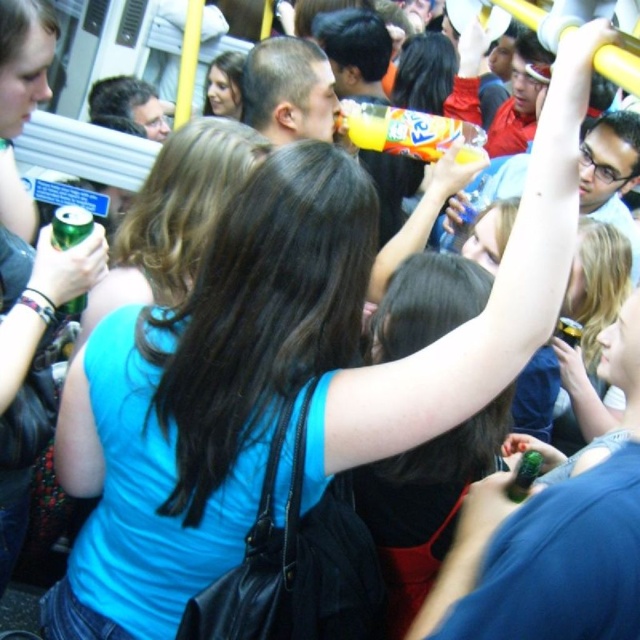
You are a passenger on a crowded public transportation vehicle. You have a green matte can at upper left that you want to place on the floor. There is a blue fabric shirt at center in the way. Can you move the can to the floor without touching the shirt?

The blue fabric shirt at center is 10.49 inches away from the green matte can at upper left. Since the distance is more than a few inches, you can likely move the can to the floor without touching the shirt.

You are a passenger on a crowded subway car and need to reach the green matte can at upper left and the green matte bottle at upper right. Which one is located higher up?

The green matte can at upper left is above the green matte bottle at upper right, so it is located higher up.

You are standing in the subway car and need to place a green matte can at upper left at a specific coordinate. What are the coordinates where you should place it?

The green matte can at upper left should be placed at coordinates point [70,225].